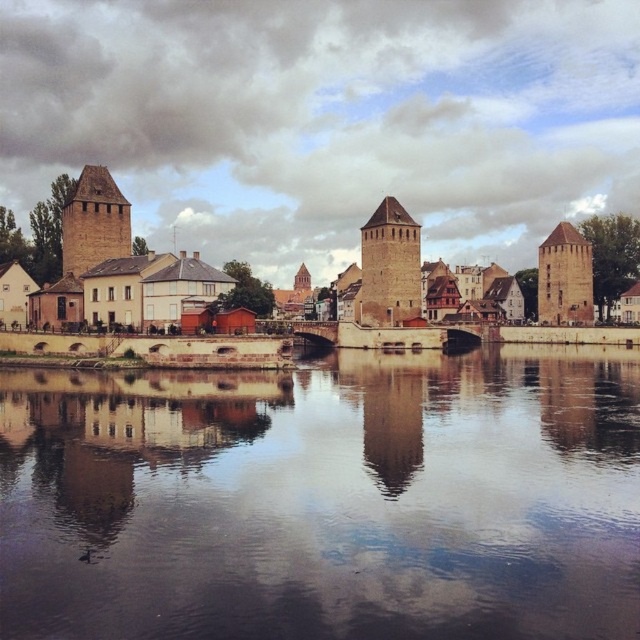
You are standing at the riverside and looking at the historic stone towers. There are two points marked in the scene. The first point is at coordinate point (106, 627) and the second point is at coordinate point (77, 221). Which of these two points is closer to you?

Point (106, 627) is closer to the camera than point (77, 221), so the first point is closer to you.

You are standing on the riverside path between the brown stone tower at left and the brown stone tower at right. Which tower is closer to your left side?

The brown stone tower at left is closer to your left side because it is positioned to the left of the brown stone tower at right.

You are standing at the point marked by coordinates point (93,221) in the riverside scene. What object are you at the location of?

The point (93,221) indicates the location of the brown stone tower at left.